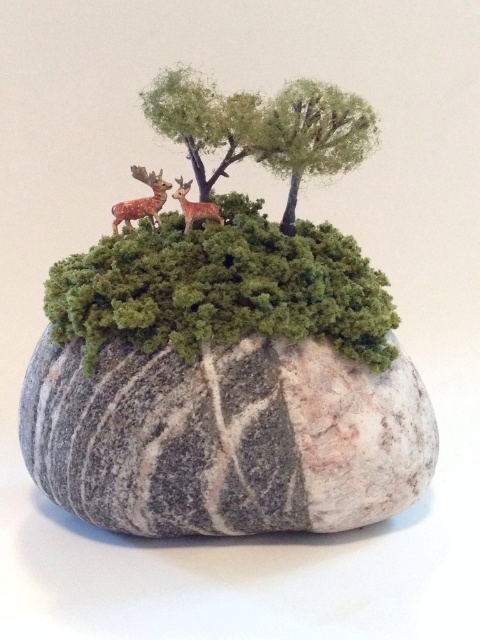
Question: Which of these objects is positioned closest to the shiny brown deer at center?

Choices:
 (A) green matte trees at upper center
 (B) green textured tree at upper center

Answer: (A)

Question: Does marble-like stone at center appear on the left side of brown matte deer at center?

Choices:
 (A) no
 (B) yes

Answer: (A)

Question: Considering the relative positions of green textured tree at upper center and brown matte deer at center in the image provided, where is green textured tree at upper center located with respect to brown matte deer at center?

Choices:
 (A) below
 (B) above

Answer: (B)

Question: Which object is the farthest from the green textured tree at upper center?

Choices:
 (A) brown matte deer at center
 (B) marble-like stone at center
 (C) shiny brown deer at center

Answer: (B)

Question: Which of the following is the farthest from the observer?

Choices:
 (A) (128, 211)
 (B) (410, 419)
 (C) (268, 109)

Answer: (A)

Question: Does green matte trees at upper center have a greater width compared to shiny brown deer at center?

Choices:
 (A) yes
 (B) no

Answer: (A)